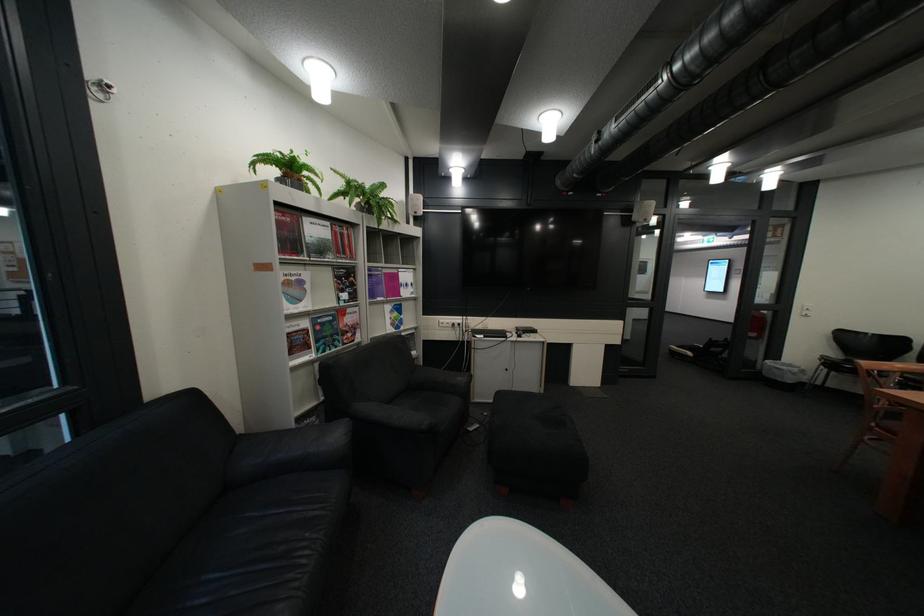
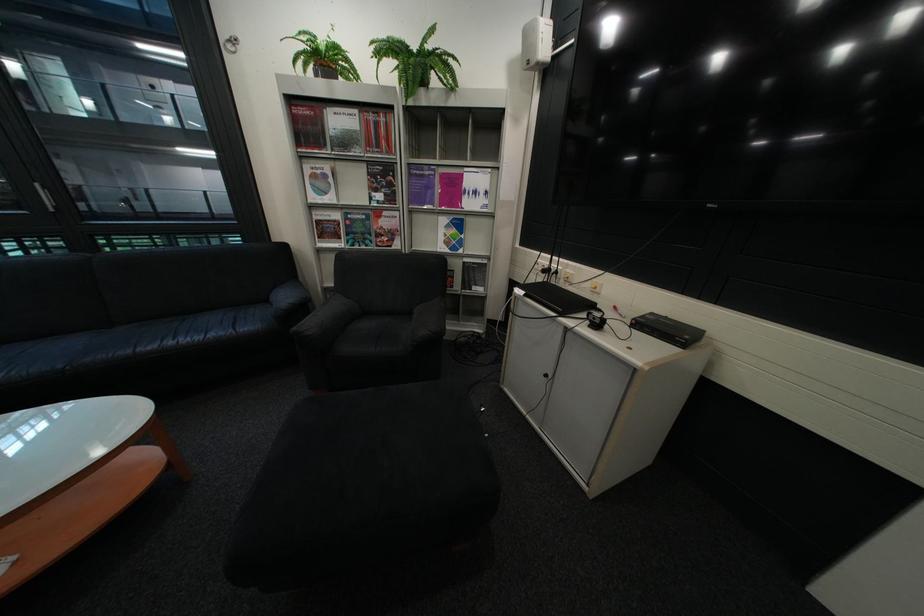
Find the pixel in the second image that matches (371,291) in the first image.

(409, 192)